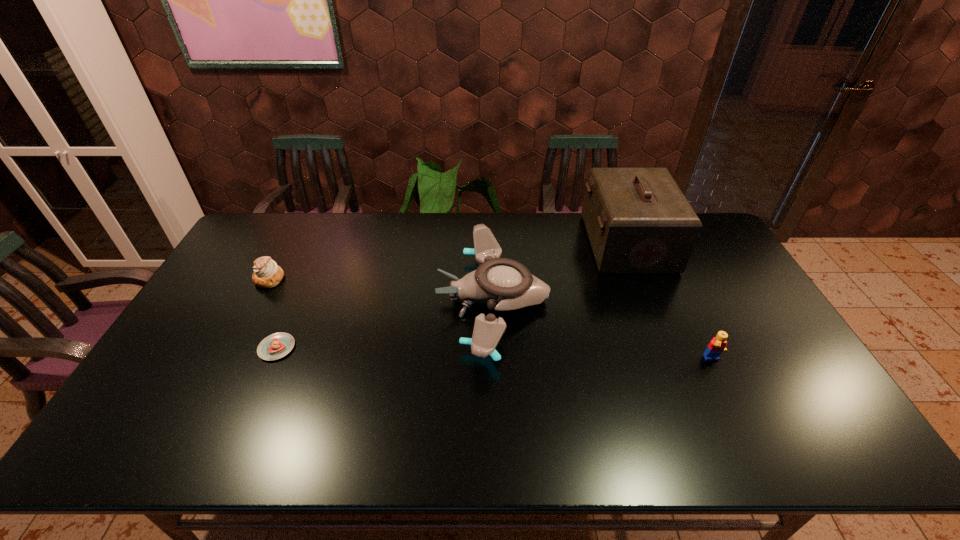
You are a GUI agent. You are given a task and a screenshot of the screen. Output one action in this format:
    pyautogui.click(x=<x>, y=<y>)
    Task: Click on the free space located on the front-facing side of the drone
    The height and width of the screenshot is (540, 960).
    Given the screenshot: What is the action you would take?
    pyautogui.click(x=334, y=300)

This screenshot has width=960, height=540. What are the coordinates of `free location located on the face of the Lego` in the screenshot? It's located at (740, 417).

This screenshot has width=960, height=540. I want to click on vacant space situated on the right of the farther pastry, so click(x=379, y=279).

The image size is (960, 540). I want to click on free location located on the back of the shorter pastry, so click(307, 278).

At what (x,y) coordinates should I click in order to perform the action: click on the first-aid kit present at the far edge. Please return your answer as a coordinate pair (x, y). This screenshot has height=540, width=960. Looking at the image, I should click on (638, 220).

Where is `drone present at the far edge`? This screenshot has width=960, height=540. drone present at the far edge is located at coordinates (503, 284).

Locate an element on the screen. This screenshot has width=960, height=540. object situated at the left edge is located at coordinates (267, 274).

Where is `blank space at the far edge`? Image resolution: width=960 pixels, height=540 pixels. blank space at the far edge is located at coordinates (457, 249).

This screenshot has height=540, width=960. What are the coordinates of `free space at the near edge of the desktop` in the screenshot? It's located at (257, 431).

In the image, there is a desktop. Where is `vacant space at the left edge`? This screenshot has height=540, width=960. vacant space at the left edge is located at coordinates (231, 279).